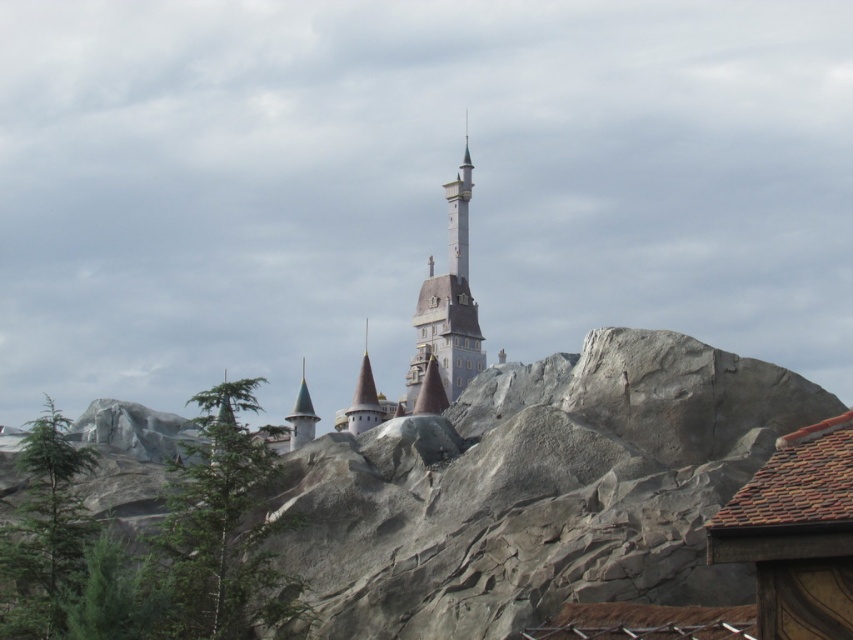
Does white stone tower at center have a larger size compared to gold spire at center?

Yes.

Can you confirm if white stone tower at center is wider than gold spire at center?

Yes.

Which is in front, point (433, 285) or point (381, 413)?

Point (381, 413)

At what (x,y) coordinates should I click in order to perform the action: click on white stone tower at center. Please return your answer as a coordinate pair (x, y). This screenshot has width=853, height=640. Looking at the image, I should click on (448, 305).

Which is more to the left, green textured tree at center-left or green matte tree at lower left?

Positioned to the left is green matte tree at lower left.

Who is shorter, green textured tree at center-left or green matte tree at lower left?

green textured tree at center-left

Describe the element at coordinates (221, 531) in the screenshot. I see `green textured tree at center-left` at that location.

Locate an element on the screen. Image resolution: width=853 pixels, height=640 pixels. green textured tree at center-left is located at coordinates (221, 531).

Can you confirm if green matte tree at lower left is positioned to the left of gold spire at center?

Yes, green matte tree at lower left is to the left of gold spire at center.

Is point (77, 464) behind point (381, 412)?

No, it is not.

I want to click on green matte tree at lower left, so coord(45,532).